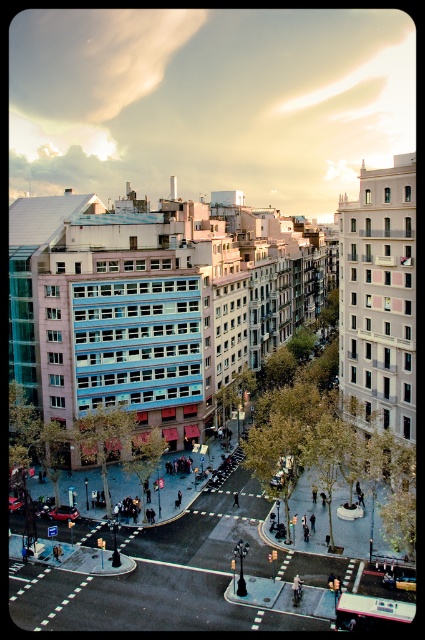
Question: Is metallic silver car at center behind metallic red car at center?

Choices:
 (A) yes
 (B) no

Answer: (B)

Question: Which of the following is the farthest from the observer?

Choices:
 (A) metallic silver car at center
 (B) metallic red car at center

Answer: (B)

Question: Which point is closer to the camera taking this photo?

Choices:
 (A) (11, 504)
 (B) (73, 506)

Answer: (A)

Question: Considering the relative positions of metallic silver car at center and metallic red car at center in the image provided, where is metallic silver car at center located with respect to metallic red car at center?

Choices:
 (A) left
 (B) right

Answer: (B)

Question: Is metallic silver car at center further to the viewer compared to metallic red car at center?

Choices:
 (A) no
 (B) yes

Answer: (A)

Question: Which point is farther from the camera taking this photo?

Choices:
 (A) (71, 513)
 (B) (11, 512)

Answer: (B)